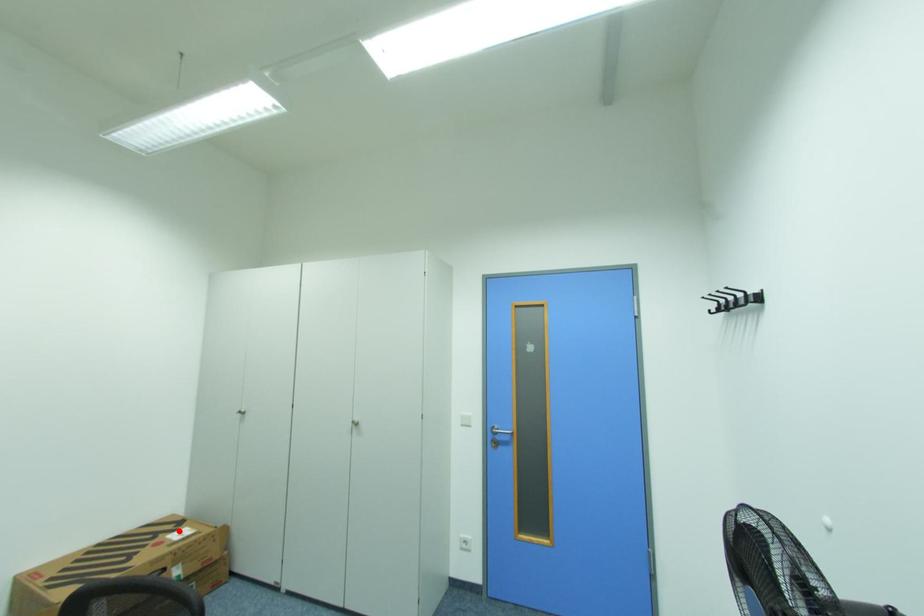
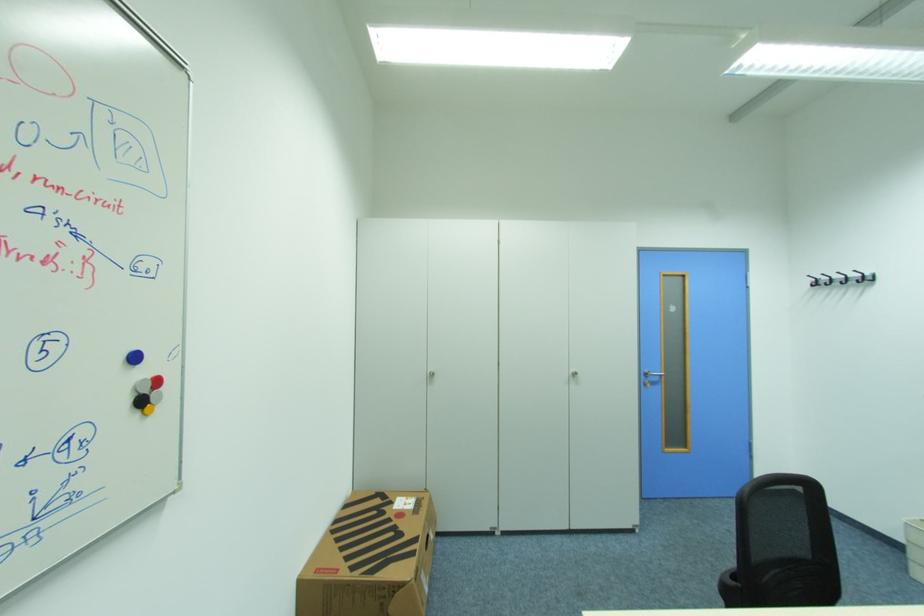
Locate, in the second image, the point that corresponds to the highlighted location in the first image.

(396, 503)